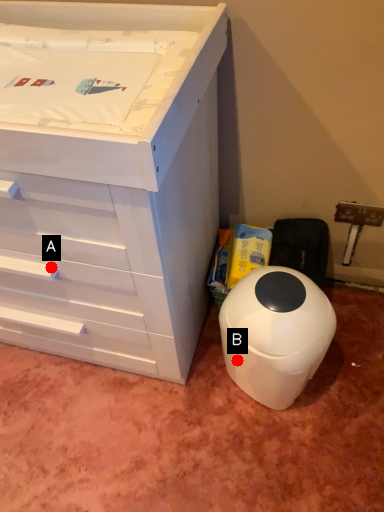
Question: Two points are circled on the image, labeled by A and B beside each circle. Which point appears farthest from the camera in this image?

Choices:
 (A) A is further
 (B) B is further

Answer: (B)